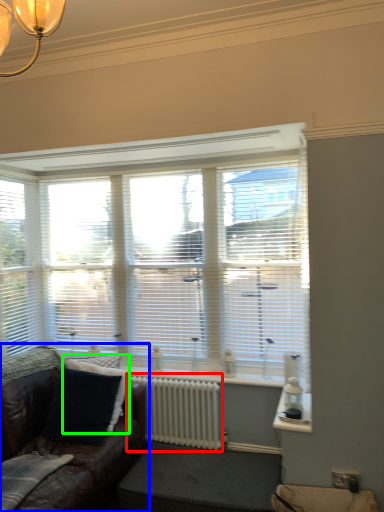
Question: Which object is the closest to the radiator (highlighted by a red box)? Choose among these: studio couch (highlighted by a blue box) or pillow (highlighted by a green box).

Choices:
 (A) studio couch
 (B) pillow

Answer: (B)